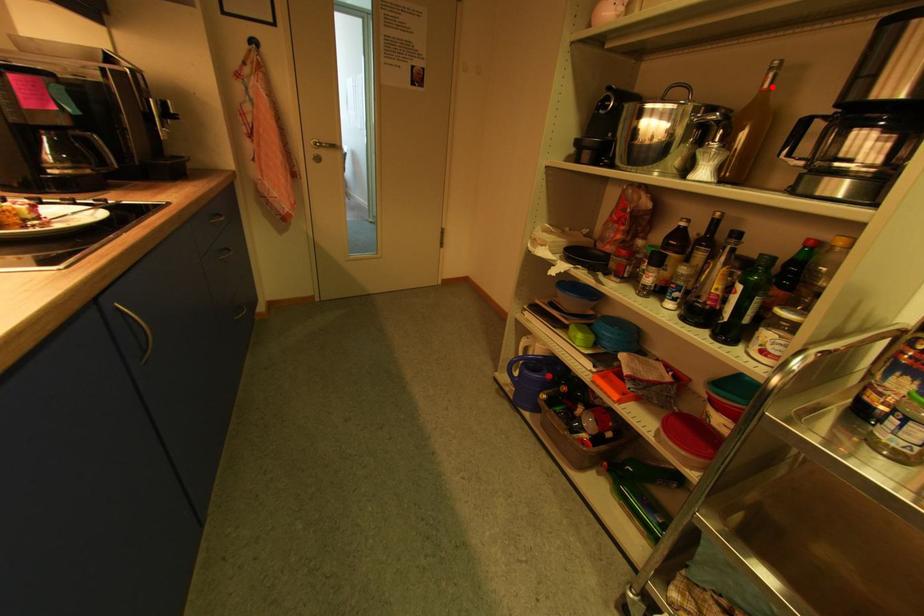
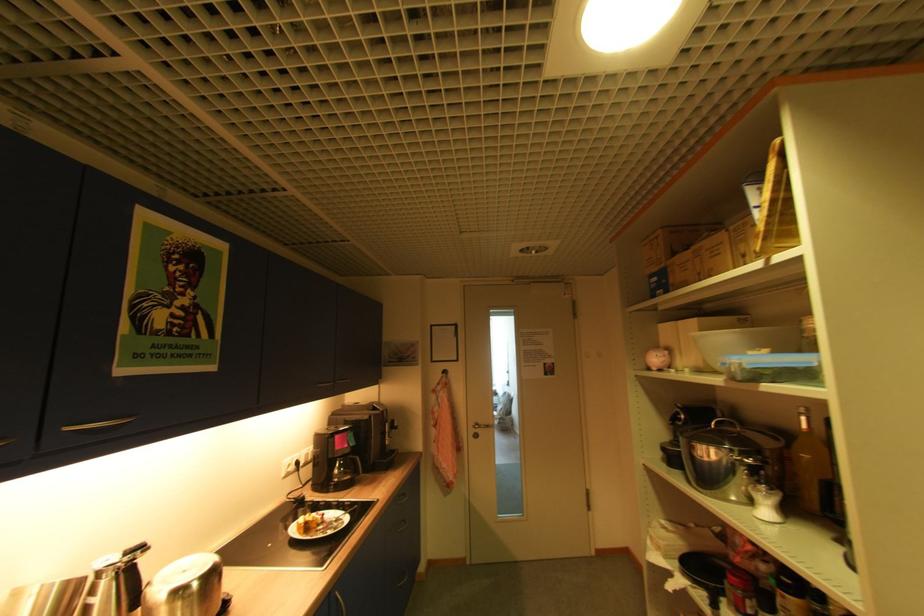
Question: I am providing you with two images of the same scene from different viewpoints. Image1 has a red point marked. In image2, the corresponding 3D location appears at what relative position? Reply with the corresponding letter.

Choices:
 (A) Closer
 (B) Farther

Answer: (A)